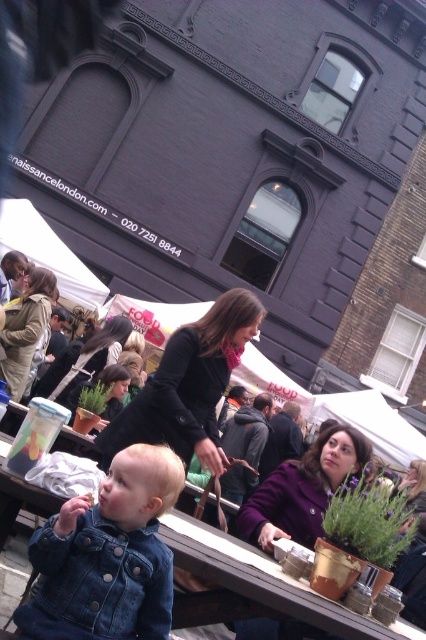
Between purple woolen coat at center and tan leather jacket at center, which one is positioned lower?

Positioned lower is purple woolen coat at center.

Who is more distant from viewer, [267,493] or [48,310]?

Point [48,310]

In order to click on purple woolen coat at center in this screenshot , I will do `click(302, 490)`.

Is faded denim jacket at lower right closer to camera compared to black matte jacket at center?

Yes, faded denim jacket at lower right is in front of black matte jacket at center.

Between faded denim jacket at lower right and black matte jacket at center, which one is positioned higher?

black matte jacket at center

Is point (155, 472) positioned after point (238, 316)?

No, (155, 472) is closer to viewer.

Locate an element on the screen. faded denim jacket at lower right is located at coordinates (108, 556).

Which of these two, purple woolen coat at center or matte black jacket at center, stands shorter?

With less height is purple woolen coat at center.

Which is more to the left, purple woolen coat at center or matte black jacket at center?

Positioned to the left is matte black jacket at center.

Where is `purple woolen coat at center`? purple woolen coat at center is located at coordinates (302, 490).